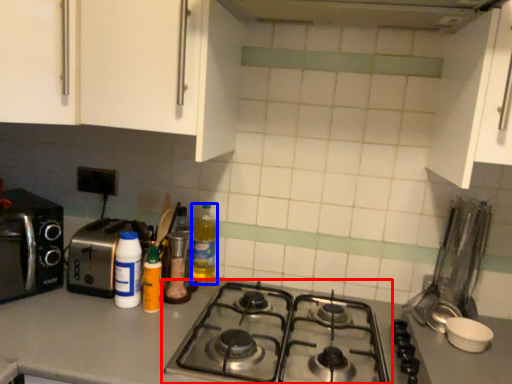
Question: Which object is closer to the camera taking this photo, gas stove (highlighted by a red box) or bottle (highlighted by a blue box)?

Choices:
 (A) gas stove
 (B) bottle

Answer: (A)